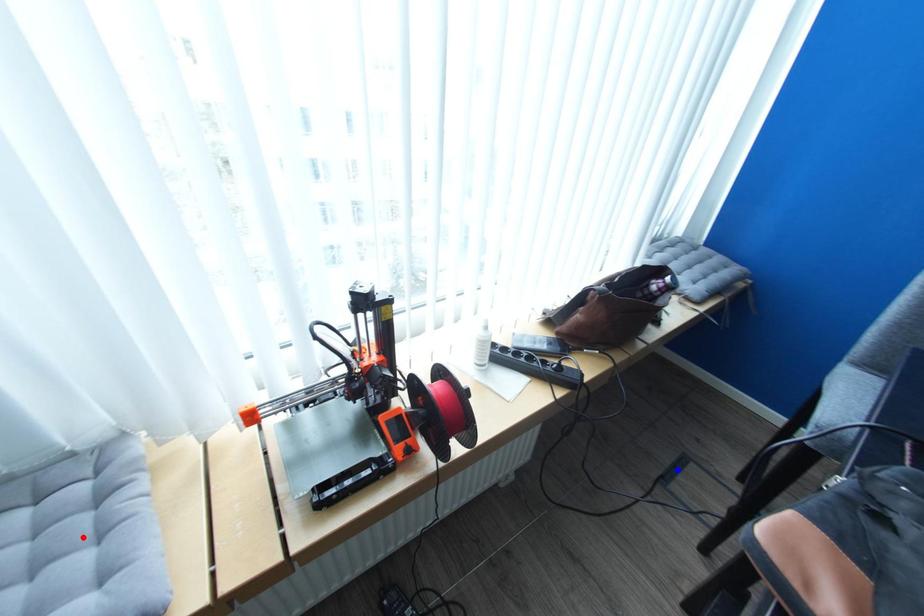
Question: In the image, two points are highlighted. Which point is nearer to the camera? Reply with the corresponding letter.

Choices:
 (A) blue point
 (B) red point

Answer: (B)